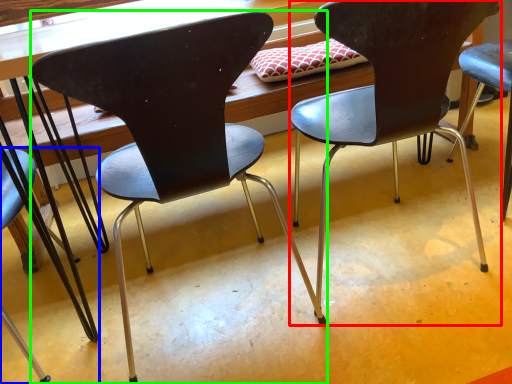
Question: Considering the real-world distances, which object is closest to chair (highlighted by a red box)? chair (highlighted by a blue box) or chair (highlighted by a green box).

Choices:
 (A) chair
 (B) chair

Answer: (B)